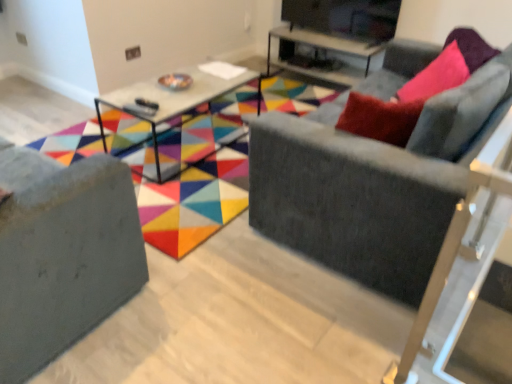
Find the location of a particular element. This screenshot has height=384, width=512. vacant region to the right of velvet grey couch at lower left, the first studio couch in the left-to-right sequence is located at coordinates pyautogui.click(x=210, y=310).